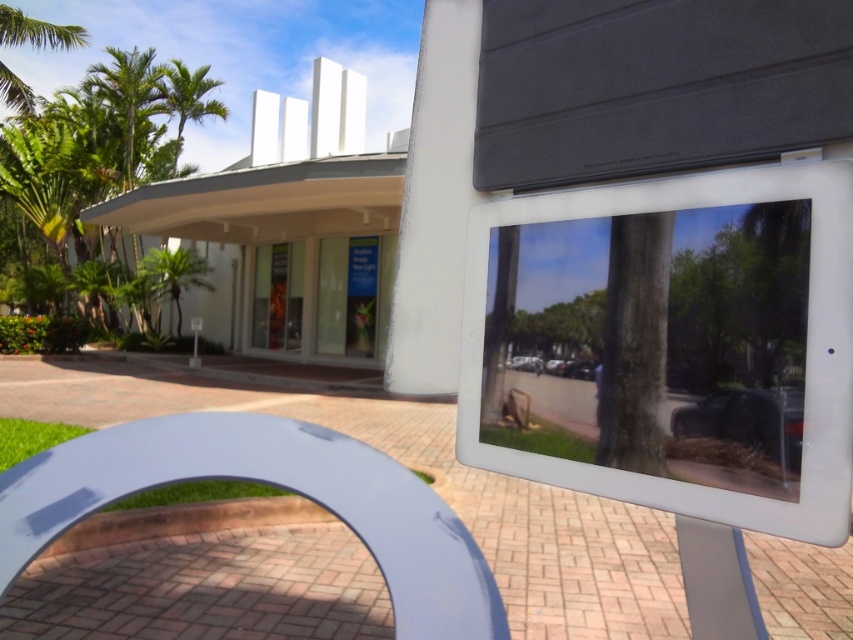
Based on the photo, measure the distance between green leafy palm tree at upper left and camera.

A distance of 74.50 feet exists between green leafy palm tree at upper left and camera.

Is green leafy palm tree at upper left further to camera compared to green leafy palm tree at center?

That is True.

You are a GUI agent. You are given a task and a screenshot of the screen. Output one action in this format:
    pyautogui.click(x=<x>, y=<y>)
    Task: Click on the green leafy palm tree at upper left
    The image size is (853, 640).
    Given the screenshot: What is the action you would take?
    pyautogui.click(x=190, y=97)

I want to click on green leafy palm tree at upper left, so click(190, 97).